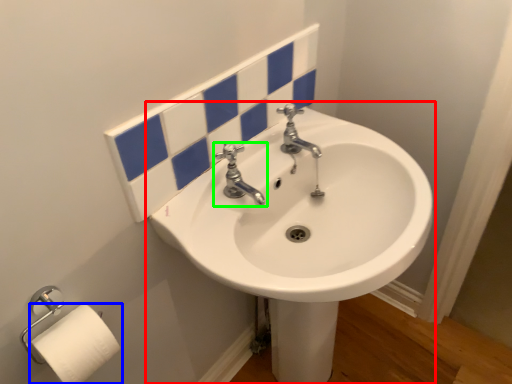
Question: Considering the real-world distances, which object is closest to sink (highlighted by a red box)? toilet paper (highlighted by a blue box) or tap (highlighted by a green box).

Choices:
 (A) toilet paper
 (B) tap

Answer: (B)